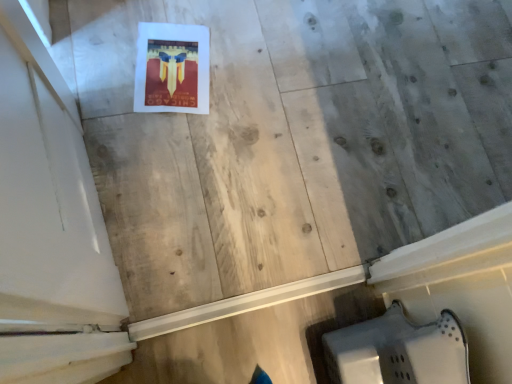
This screenshot has width=512, height=384. Describe the element at coordinates (47, 194) in the screenshot. I see `white matte door at upper left` at that location.

What is the approximate width of white matte door at upper left?

3.19 inches.

Locate an element on the screen. white matte door at upper left is located at coordinates (47, 194).

Find the location of `white matte door at upper left`. white matte door at upper left is located at coordinates (47, 194).